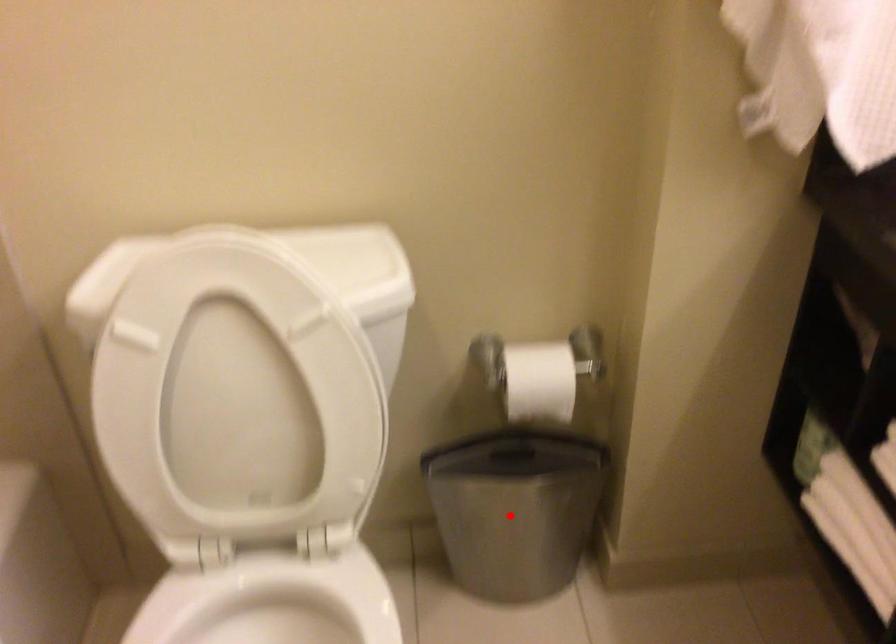
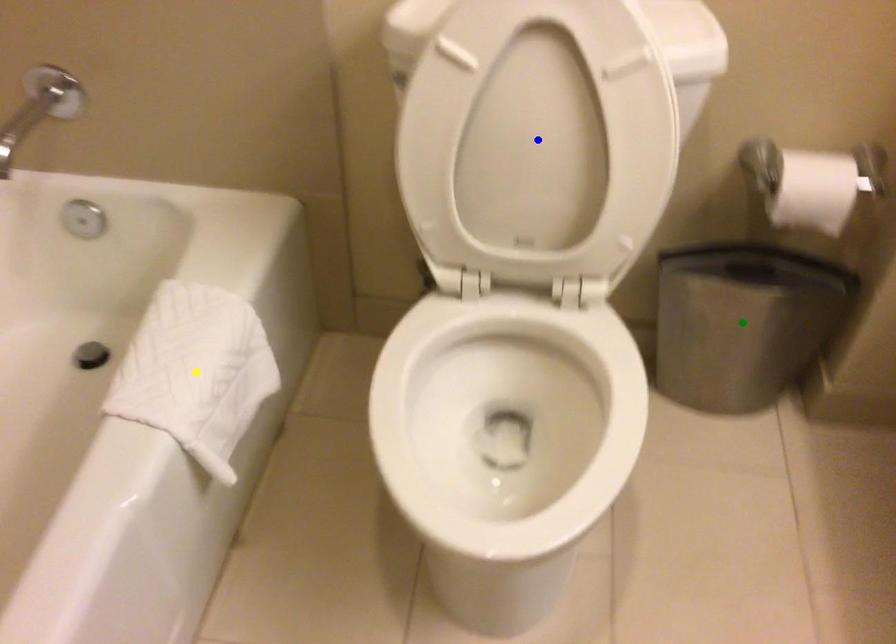
Question: I am providing you with two images of the same scene from different viewpoints. A red point is marked on the first image. You are given multiple points on the second image. Which point in image 2 is actually the same real-world point as the red point in image 1?

Choices:
 (A) blue point
 (B) yellow point
 (C) green point

Answer: (C)